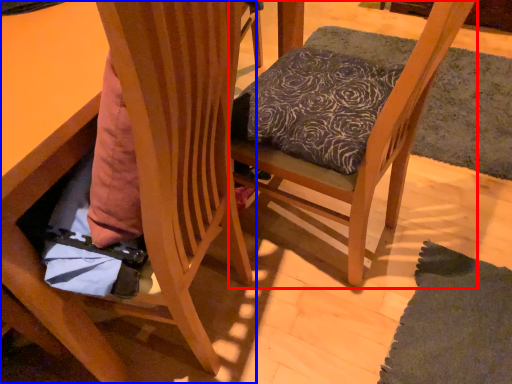
Question: Among these objects, which one is farthest to the camera, chair (highlighted by a red box) or chair (highlighted by a blue box)?

Choices:
 (A) chair
 (B) chair

Answer: (A)